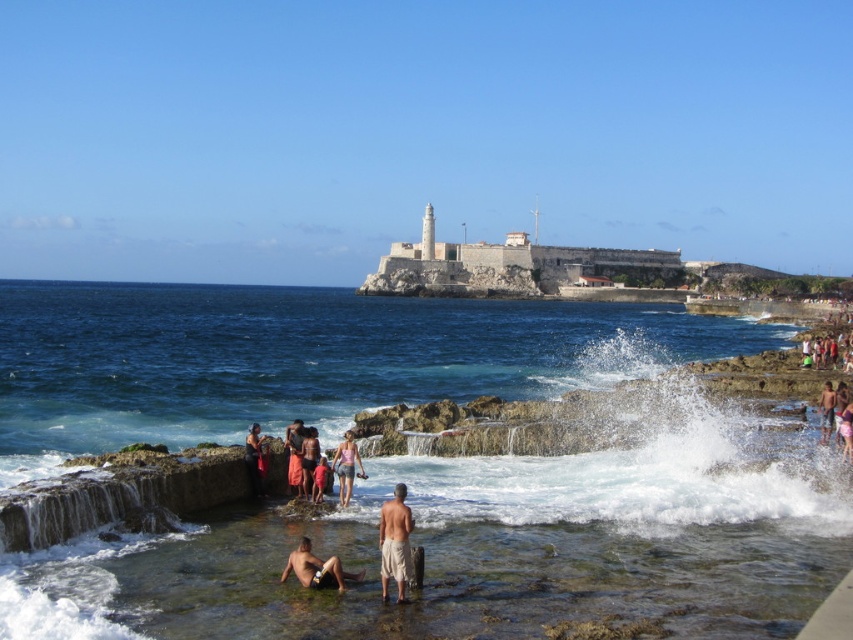
You are a photographer taking a picture of the coastal scene. You want to focus on the matte black swimsuit at center and light brown skin at lower right. Which subject is positioned closer to the camera?

The matte black swimsuit at center is closer to the viewer than the light brown skin at lower right, so the matte black swimsuit at center would be the subject closer to the camera.

You are a photographer positioned at the shore and want to capture both the point at (383, 516) and the point at (294, 433) in your photo. Which point will appear larger in the photo?

Point at (383, 516) will appear larger in the photo because it is closer to the viewer than point at (294, 433).